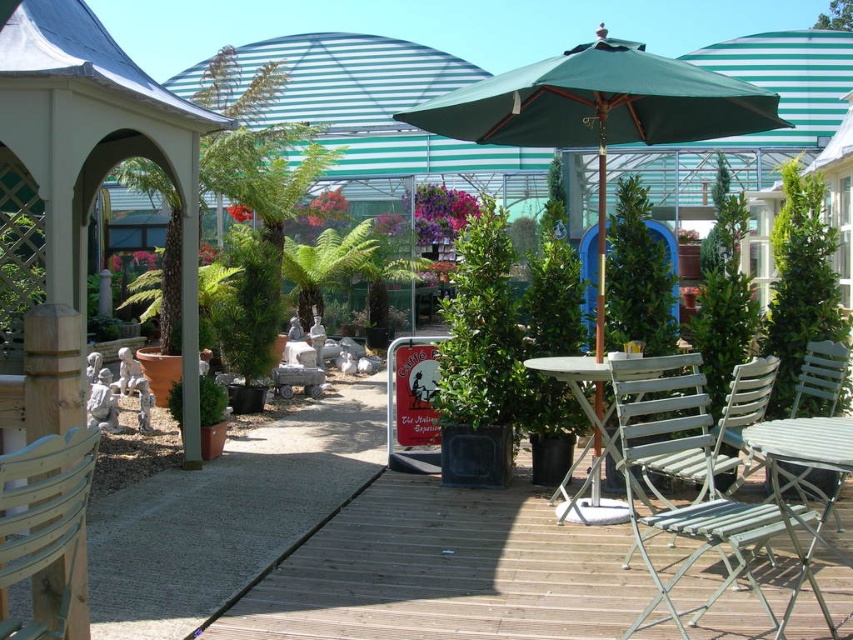
You are standing at the entrance of the garden and want to place a new bench exactly at the center of the garden. The current center is marked by the green fabric umbrella at center. Where should you place the bench?

The green fabric umbrella at center is located at point (599, 109), so you should place the bench at that coordinate to be at the center of the garden.

You are planning to place a small potted plant between the green leafy bush at center and the metallic silver chair at lower right. Based on their sizes, which object should the potted plant be closer to?

The potted plant should be closer to the metallic silver chair at lower right because the green leafy bush at center is larger and may cast more shade, making the area near the metallic silver chair at lower right a better spot for the plant to receive adequate sunlight.